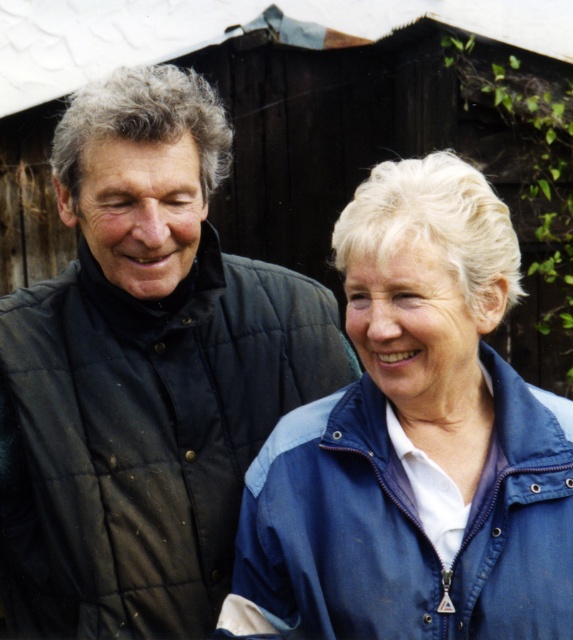
You are taking a photo of two people standing in front of a wooden shed. You want to focus on the person closer to the camera. Which of the two points, point (211, 452) or point (477, 540), should you focus on?

Point (211, 452) is closer to the camera than point (477, 540), so you should focus on point (211, 452) to capture the person closer to the camera.

You are a photographer trying to focus on the matte black jacket at left. The camera has a focus point at coordinates point (143, 372). Is this focus point correctly positioned to capture the matte black jacket at left?

Yes, the focus point at point (143, 372) is correctly positioned because the Objects Description states that this point corresponds to the matte black jacket at left.